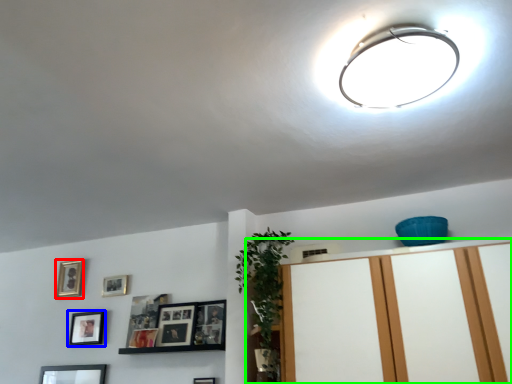
Question: Estimate the real-world distances between objects in this image. Which object is farther from picture frame (highlighted by a red box), picture frame (highlighted by a blue box) or dresser (highlighted by a green box)?

Choices:
 (A) picture frame
 (B) dresser

Answer: (B)